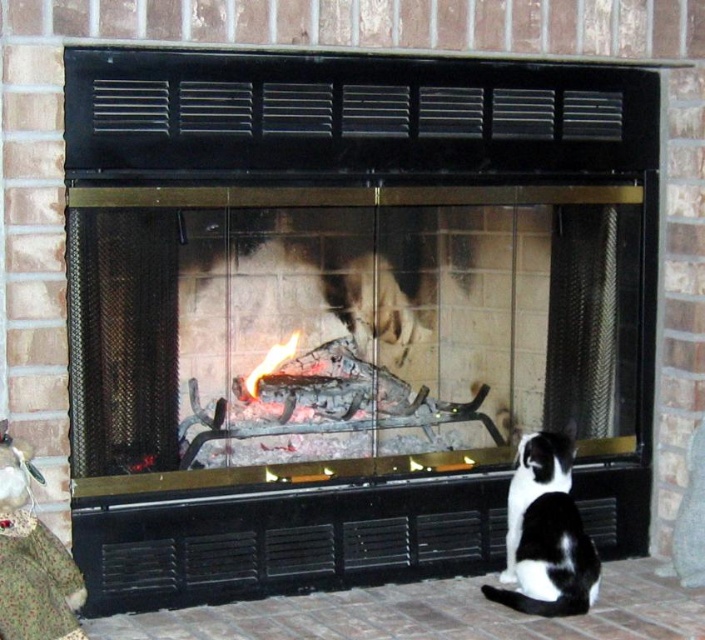
You are standing in front of the fireplace and want to pet the black and white fur cat at lower right. Where should you move to reach the cat?

The black and white fur cat at lower right is located at point (545, 534), so you should move towards the lower right direction to reach the cat.